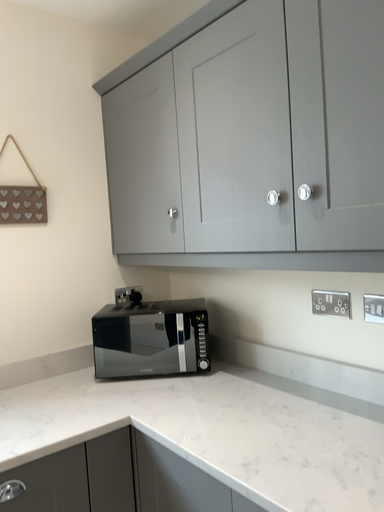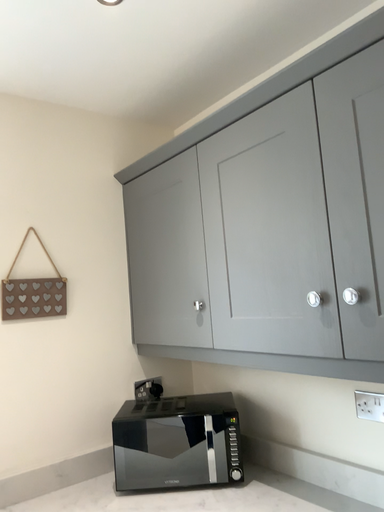
Question: How did the camera likely rotate when shooting the video?

Choices:
 (A) rotated downward
 (B) rotated upward

Answer: (B)